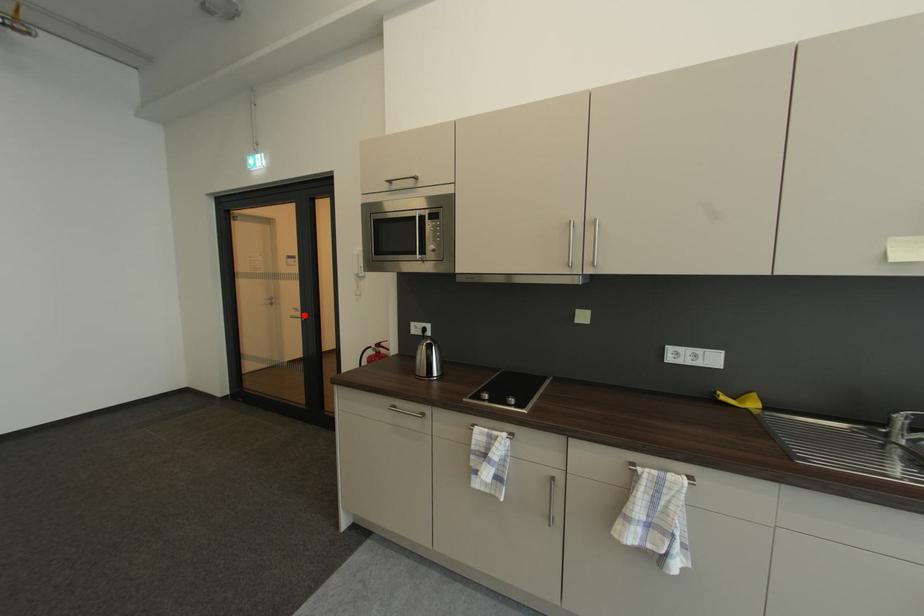
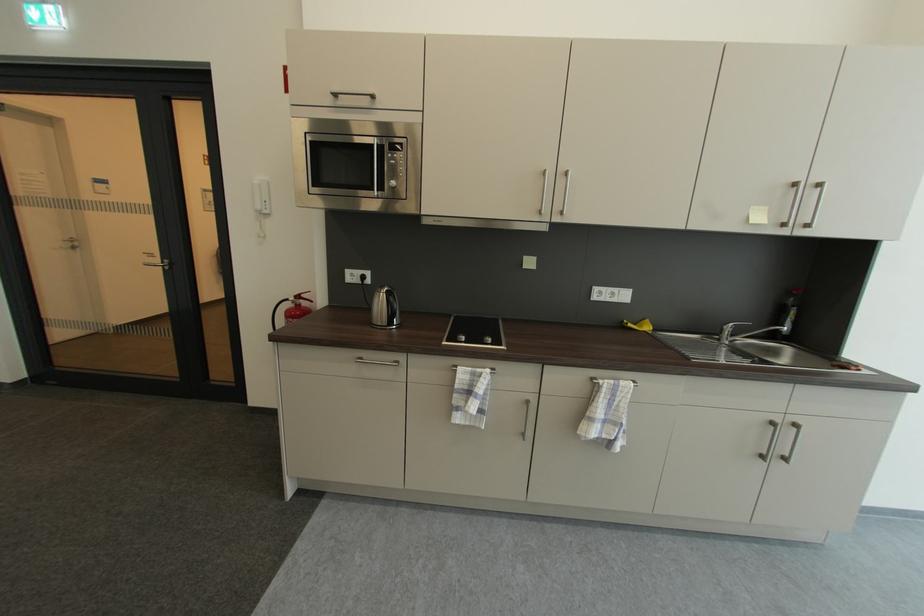
Question: I am providing you with two images of the same scene from different viewpoints. A red point is marked on the first image. Is the red point's position out of view in image 2?

Choices:
 (A) Yes
 (B) No

Answer: (B)